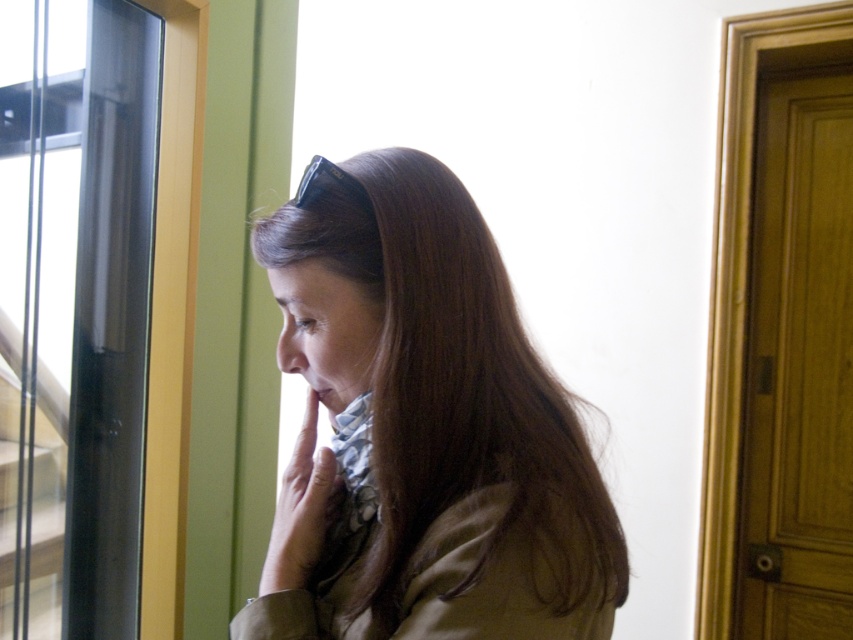
Does transparent glass door at right have a larger size compared to matte black hand at center?

Indeed, transparent glass door at right has a larger size compared to matte black hand at center.

Is transparent glass door at right closer to the viewer compared to matte black hand at center?

That is False.

Which is behind, point (851, 244) or point (282, 579)?

Positioned behind is point (851, 244).

Image resolution: width=853 pixels, height=640 pixels. In order to click on transparent glass door at right in this screenshot , I will do `click(798, 364)`.

Between transparent glass door at left and matte black hand at center, which one appears on the right side from the viewer's perspective?

matte black hand at center

Is transparent glass door at left below matte black hand at center?

No.

Does point (4, 140) come farther from viewer compared to point (334, 488)?

Yes, it is behind point (334, 488).

In order to click on transparent glass door at left in this screenshot , I will do `click(74, 310)`.

Is brown matte hair at center wider than transparent glass door at left?

No.

Can you confirm if brown matte hair at center is shorter than transparent glass door at left?

Yes, brown matte hair at center is shorter than transparent glass door at left.

The image size is (853, 640). What do you see at coordinates (422, 429) in the screenshot?
I see `brown matte hair at center` at bounding box center [422, 429].

Locate an element on the screen. The width and height of the screenshot is (853, 640). brown matte hair at center is located at coordinates (422, 429).